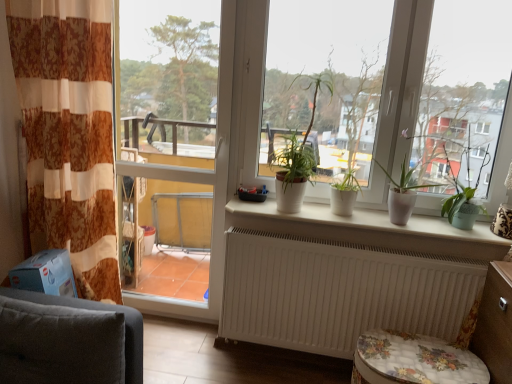
Locate an element on the screen. This screenshot has height=384, width=512. free location to the left of white matte pot at center, marked as the second houseplant in a right-to-left arrangement is located at coordinates (310, 213).